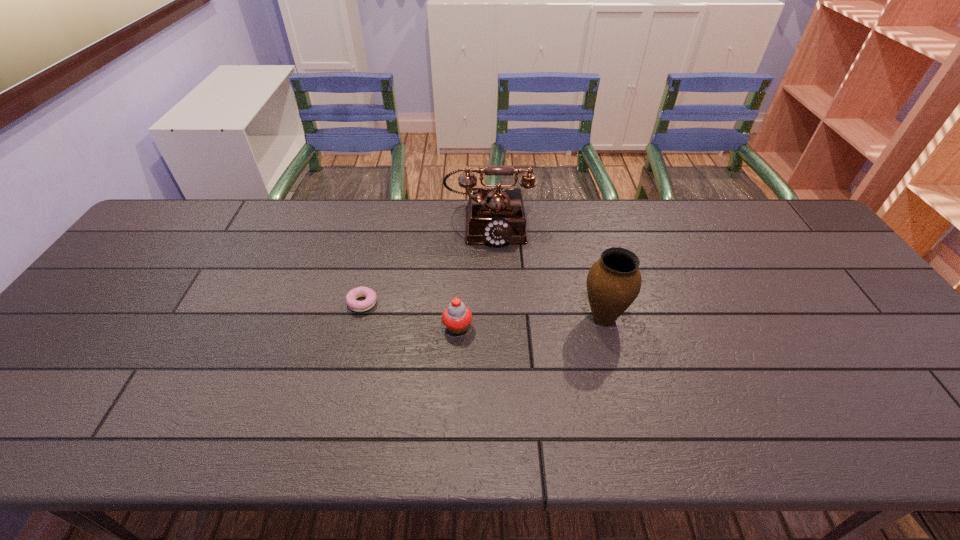
Locate an element on the screen. telephone is located at coordinates (496, 216).

Where is `the rightmost object`? This screenshot has width=960, height=540. the rightmost object is located at coordinates (614, 281).

This screenshot has width=960, height=540. In order to click on the third tallest object in this screenshot , I will do `click(457, 317)`.

Find the location of `doughnut`. doughnut is located at coordinates (351, 298).

Identify the location of the leftmost object. This screenshot has width=960, height=540. (351, 298).

Where is `free spot located 0.070m on the dial of the farthest object`? free spot located 0.070m on the dial of the farthest object is located at coordinates (490, 265).

Where is `blank space located 0.290m on the right of the urn`? This screenshot has height=540, width=960. blank space located 0.290m on the right of the urn is located at coordinates (739, 316).

Identify the location of vacant space located on the back of the cupcake. (461, 265).

Where is `vacant space located 0.180m on the front of the shortest object`? vacant space located 0.180m on the front of the shortest object is located at coordinates (345, 374).

I want to click on object present at the far edge, so click(496, 216).